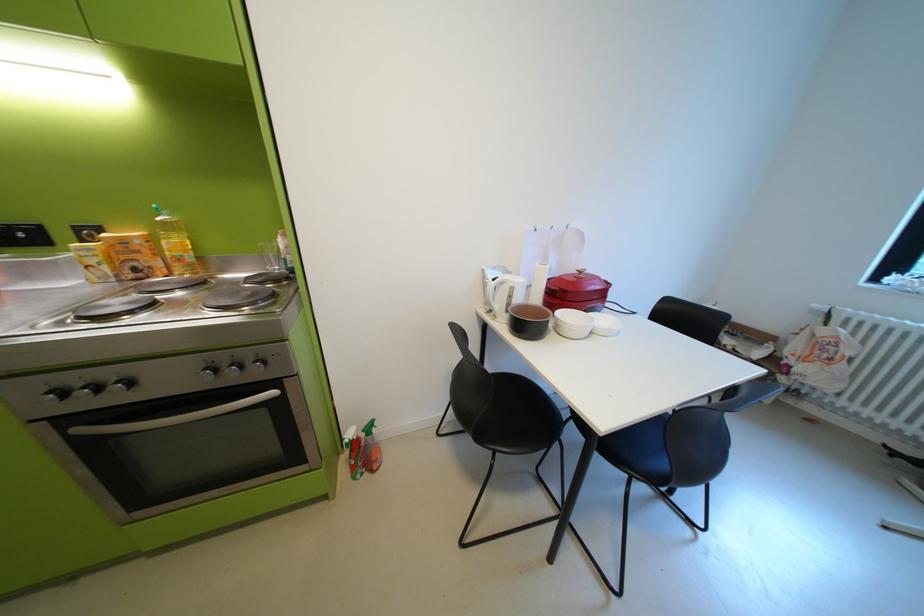
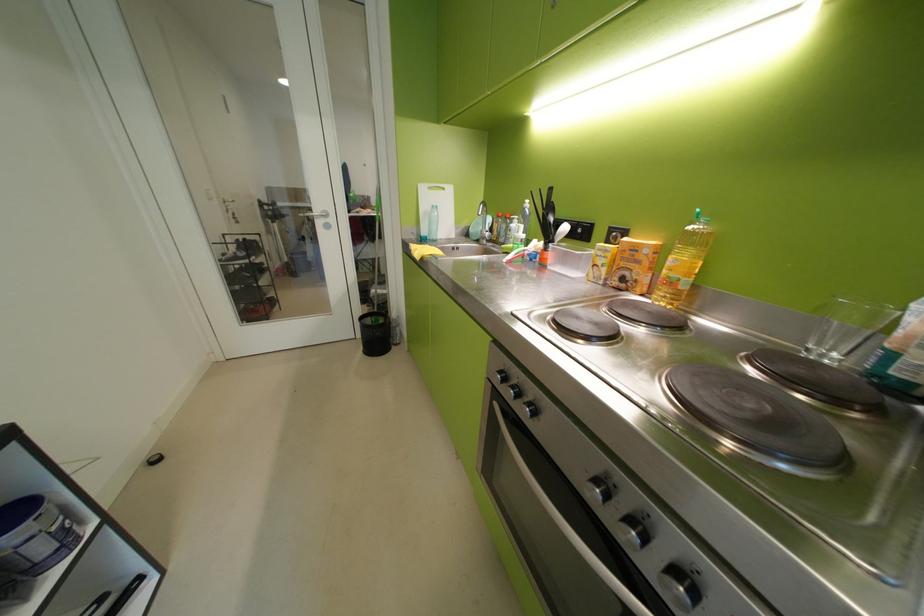
In the second image, find the point that corresponds to point (91, 403) in the first image.

(517, 394)